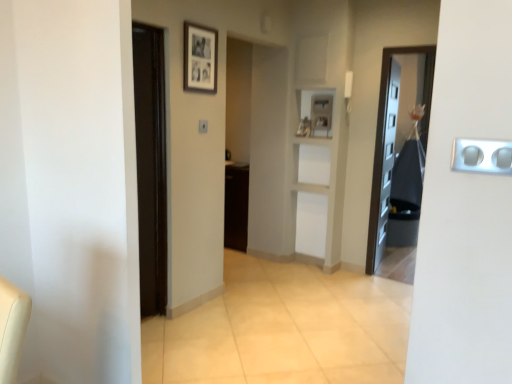
Describe the element at coordinates (400, 149) in the screenshot. This screenshot has height=384, width=512. I see `black fabric bag at right` at that location.

Image resolution: width=512 pixels, height=384 pixels. Identify the location of white plastic light switch at center. (203, 126).

What do you see at coordinates (203, 126) in the screenshot?
I see `white plastic light switch at center` at bounding box center [203, 126].

The image size is (512, 384). In order to click on silver metallic outlet at right in this screenshot , I will do `click(482, 156)`.

Which point is more forward, (498, 173) or (204, 50)?

The point (498, 173) is in front.

Where is `picture frame above the silver metallic outlet at right (from a real-world perspective)`? picture frame above the silver metallic outlet at right (from a real-world perspective) is located at coordinates (200, 58).

Visually, is silver metallic outlet at right positioned to the left or to the right of black matte picture frame at upper center?

silver metallic outlet at right is positioned on black matte picture frame at upper center's right side.

Between silver metallic outlet at right and black matte picture frame at upper center, which one has more height?

black matte picture frame at upper center.

Is black fabric bag at right wider or thinner than black matte picture frame at upper center?

In the image, black fabric bag at right appears to be wider than black matte picture frame at upper center.

Considering the sizes of objects black fabric bag at right and black matte picture frame at upper center in the image provided, who is bigger, black fabric bag at right or black matte picture frame at upper center?

Answer: Bigger between the two is black fabric bag at right.

From a real-world perspective, does black fabric bag at right stand above black matte picture frame at upper center?

Actually, black fabric bag at right is physically below black matte picture frame at upper center in the real world.

Does point (399, 154) appear closer or farther from the camera than point (204, 76)?

Point (399, 154).

Considering the relative sizes of black fabric bag at right and white plastic light switch at center in the image provided, is black fabric bag at right wider than white plastic light switch at center?

Indeed, black fabric bag at right has a greater width compared to white plastic light switch at center.

Could you tell me if black fabric bag at right is turned towards white plastic light switch at center?

No, black fabric bag at right is not oriented towards white plastic light switch at center.

Which object is further away from the camera, black fabric bag at right or white plastic light switch at center?

Positioned behind is black fabric bag at right.

From a real-world perspective, between black fabric bag at right and white plastic light switch at center, who is vertically higher?

From a 3D spatial view, white plastic light switch at center is above.

Is white plastic light switch at center aimed at silver metallic outlet at right?

No.

Who is smaller, white plastic light switch at center or silver metallic outlet at right?

white plastic light switch at center is smaller.

Can silver metallic outlet at right be found inside white plastic light switch at center?

No, silver metallic outlet at right is not inside white plastic light switch at center.

At what (x,y) coordinates should I click in order to perform the action: click on door handle below the black matte picture frame at upper center (from the image's perspective). Please return your answer as a coordinate pair (x, y). Looking at the image, I should click on (482, 156).

Does black matte picture frame at upper center have a smaller size compared to silver metallic outlet at right?

No, black matte picture frame at upper center is not smaller than silver metallic outlet at right.

Is black matte picture frame at upper center in front of or behind silver metallic outlet at right in the image?

Clearly, black matte picture frame at upper center is behind silver metallic outlet at right.

Measure the distance between black matte picture frame at upper center and silver metallic outlet at right.

The distance of black matte picture frame at upper center from silver metallic outlet at right is 7.25 feet.

Does point (471, 148) come closer to viewer compared to point (207, 126)?

Yes, it is in front of point (207, 126).

The width and height of the screenshot is (512, 384). Find the location of `door handle in front of the white plastic light switch at center`. door handle in front of the white plastic light switch at center is located at coordinates (482, 156).

Who is taller, silver metallic outlet at right or white plastic light switch at center?

white plastic light switch at center is taller.

From the image's perspective, between silver metallic outlet at right and white plastic light switch at center, which one is located above?

From the image's view, white plastic light switch at center is above.

Is white plastic light switch at center shorter than black fabric bag at right?

Correct, white plastic light switch at center is not as tall as black fabric bag at right.

Are white plastic light switch at center and black fabric bag at right located far from each other?

white plastic light switch at center is far away from black fabric bag at right.

Is white plastic light switch at center closer to the viewer compared to black fabric bag at right?

Yes.

From the image's perspective, is white plastic light switch at center located above or below black fabric bag at right?

white plastic light switch at center is situated higher than black fabric bag at right in the image.

This screenshot has width=512, height=384. I want to click on door handle in front of the black matte picture frame at upper center, so click(482, 156).

Find the location of a particular element. The height and width of the screenshot is (384, 512). picture frame above the black fabric bag at right (from the image's perspective) is located at coordinates (200, 58).

Considering their positions, is silver metallic outlet at right positioned further to black matte picture frame at upper center than black fabric bag at right?

black fabric bag at right is positioned further to the anchor black matte picture frame at upper center.

Which object lies further to the anchor point white plastic light switch at center, silver metallic outlet at right or black fabric bag at right?

black fabric bag at right is further to white plastic light switch at center.

Considering their positions, is black matte picture frame at upper center positioned closer to black fabric bag at right than silver metallic outlet at right?

Based on the image, black matte picture frame at upper center appears to be nearer to black fabric bag at right.

Considering their positions, is silver metallic outlet at right positioned further to black fabric bag at right than black matte picture frame at upper center?

Based on the image, silver metallic outlet at right appears to be further to black fabric bag at right.

Considering their positions, is white plastic light switch at center positioned further to silver metallic outlet at right than black matte picture frame at upper center?

white plastic light switch at center lies further to silver metallic outlet at right than the other object.

Considering their positions, is white plastic light switch at center positioned closer to black matte picture frame at upper center than silver metallic outlet at right?

white plastic light switch at center is closer to black matte picture frame at upper center.

From the image, which object appears to be farther from black fabric bag at right, white plastic light switch at center or silver metallic outlet at right?

silver metallic outlet at right lies further to black fabric bag at right than the other object.

When comparing their distances from silver metallic outlet at right, does black fabric bag at right or black matte picture frame at upper center seem closer?

Among the two, black matte picture frame at upper center is located nearer to silver metallic outlet at right.

This screenshot has width=512, height=384. In order to click on picture frame between silver metallic outlet at right and white plastic light switch at center along the z-axis in this screenshot , I will do `click(200, 58)`.

In order to click on light switch located between silver metallic outlet at right and black fabric bag at right in the depth direction in this screenshot , I will do `click(203, 126)`.

You are a GUI agent. You are given a task and a screenshot of the screen. Output one action in this format:
    pyautogui.click(x=<x>, y=<y>)
    Task: Click on the picture frame between silver metallic outlet at right and black fabric bag at right along the z-axis
    
    Given the screenshot: What is the action you would take?
    pyautogui.click(x=200, y=58)

Image resolution: width=512 pixels, height=384 pixels. Find the location of `picture frame situated between white plastic light switch at center and black fabric bag at right from left to right`. picture frame situated between white plastic light switch at center and black fabric bag at right from left to right is located at coordinates pos(200,58).